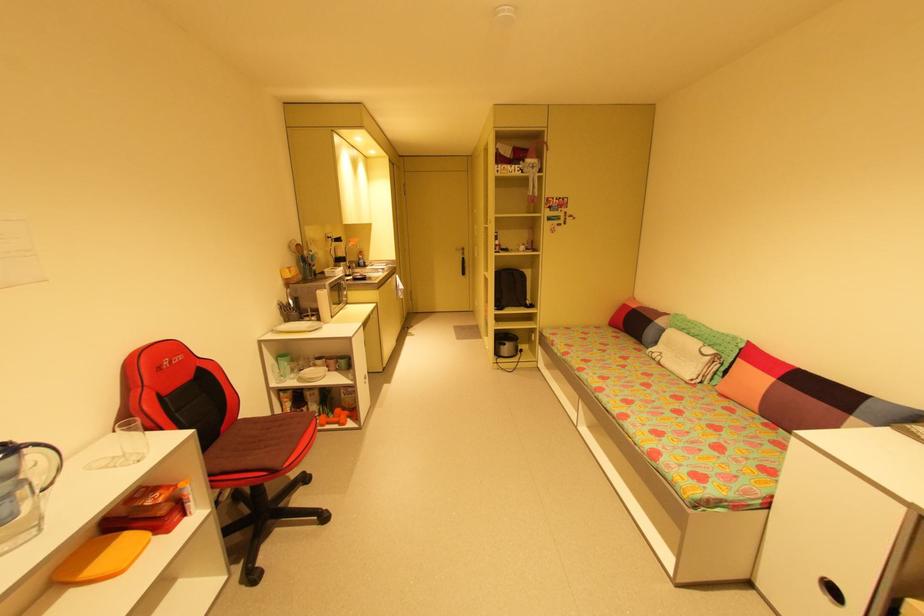
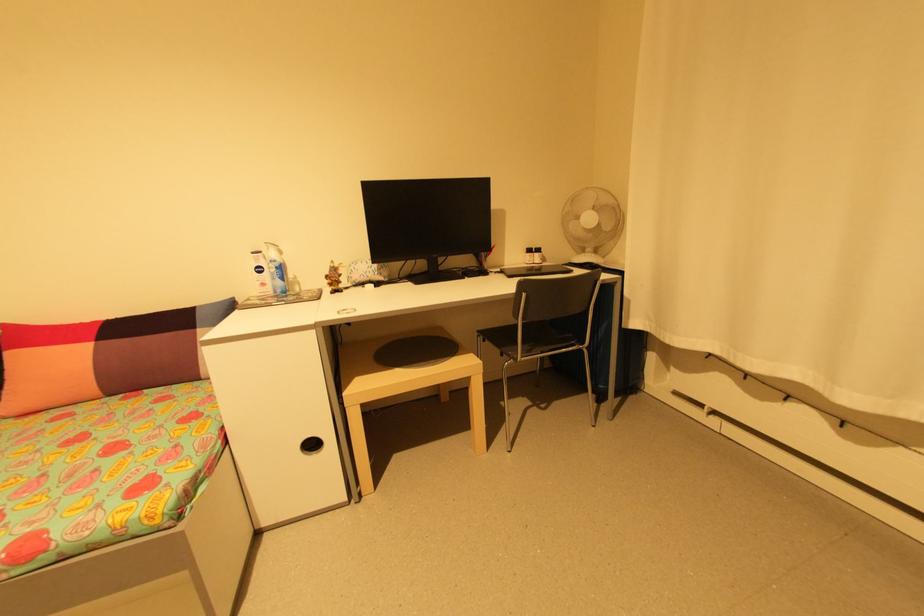
In the second image, find the point that corresponds to (762,416) in the first image.

(111, 399)